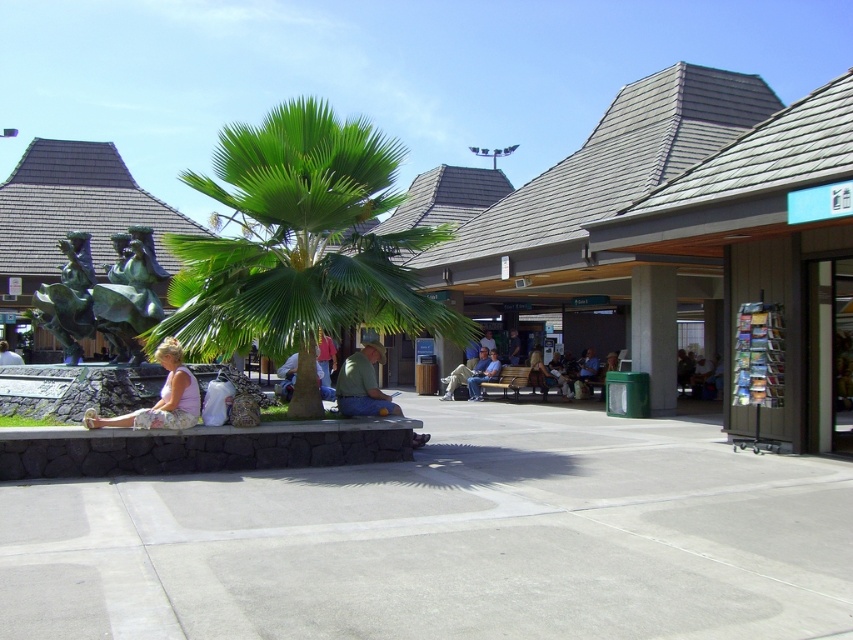
Question: Which point is closer to the camera?

Choices:
 (A) light brown leather jacket at center
 (B) green metallic statue at left

Answer: (B)

Question: Does light brown leather jacket at center have a greater width compared to light blue jeans at center?

Choices:
 (A) no
 (B) yes

Answer: (B)

Question: Which point is farther from the camera taking this photo?

Choices:
 (A) (467, 369)
 (B) (161, 404)
 (C) (346, 381)

Answer: (A)

Question: Does bronze statue at left lie in front of pink fabric dress at lower left?

Choices:
 (A) no
 (B) yes

Answer: (B)

Question: Can you confirm if bronze statue at left is positioned above light blue jeans at center?

Choices:
 (A) no
 (B) yes

Answer: (B)

Question: Which object is closer to the camera taking this photo?

Choices:
 (A) green matte shirt at center
 (B) bronze statue at left
 (C) green metallic statue at left

Answer: (C)